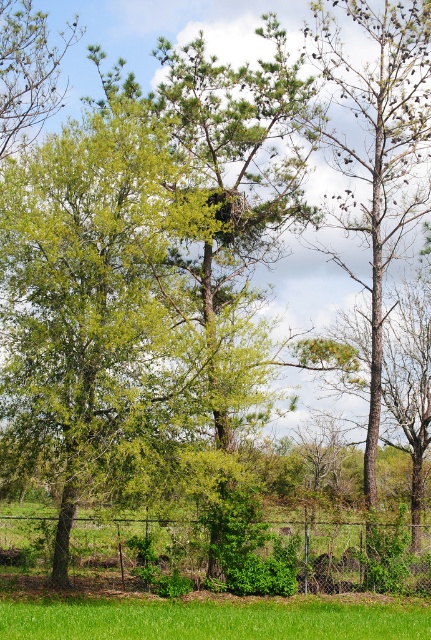
Is chain link fence at lower center to the right of green leafy tree at upper left from the viewer's perspective?

Yes, chain link fence at lower center is to the right of green leafy tree at upper left.

This screenshot has width=431, height=640. What do you see at coordinates (331, 557) in the screenshot?
I see `chain link fence at lower center` at bounding box center [331, 557].

Which is behind, point (171, 536) or point (31, 100)?

The point (31, 100) is more distant.

Where is `chain link fence at lower center`? The width and height of the screenshot is (431, 640). chain link fence at lower center is located at coordinates (331, 557).

Does green grass at lower center appear on the left side of green leafy tree at upper left?

In fact, green grass at lower center is to the right of green leafy tree at upper left.

Who is lower down, green grass at lower center or green leafy tree at upper left?

green grass at lower center is below.

Between point (103, 609) and point (52, 92), which one is positioned in front?

Positioned in front is point (103, 609).

Find the location of a particular element. Image resolution: width=431 pixels, height=640 pixels. green grass at lower center is located at coordinates (212, 620).

Is chain link fence at lower center positioned behind green grass at lower center?

That is True.

Looking at this image, between chain link fence at lower center and green grass at lower center, which one is positioned higher?

green grass at lower center is above.

Is point (387, 536) in front of point (74, 632)?

No.

The height and width of the screenshot is (640, 431). I want to click on chain link fence at lower center, so click(331, 557).